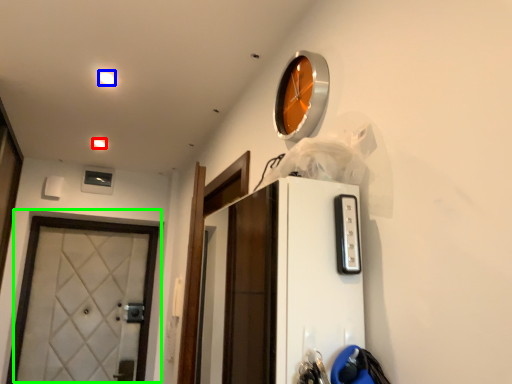
Question: Which object is positioned closest to light (highlighted by a red box)? Select from light (highlighted by a blue box) and door (highlighted by a green box).

Choices:
 (A) light
 (B) door

Answer: (A)